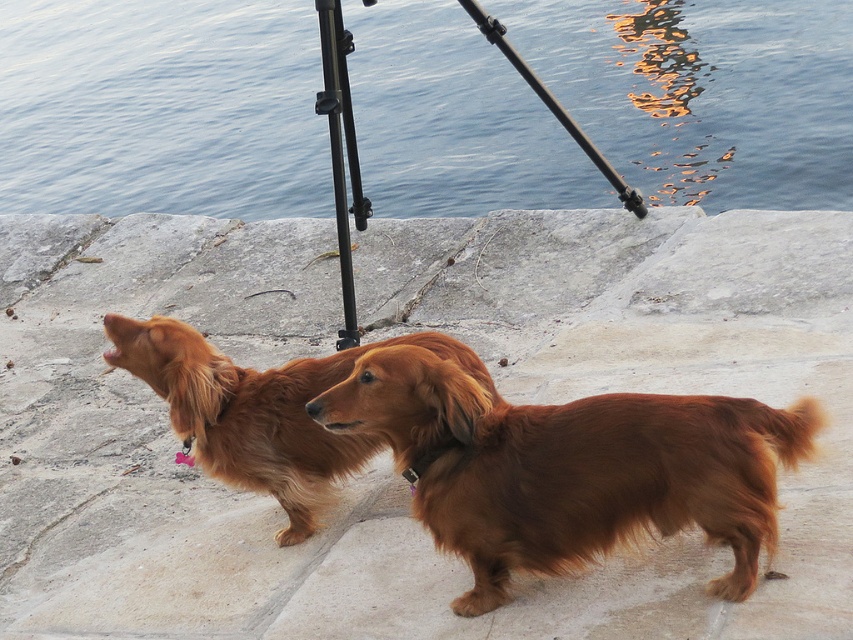
Question: Is brown furry dog at center above shiny brown fur at center?

Choices:
 (A) yes
 (B) no

Answer: (B)

Question: Does smooth concrete stone at center appear on the left side of shiny brown fur at center?

Choices:
 (A) no
 (B) yes

Answer: (A)

Question: Based on their relative distances, which object is farther from the blue water at upper center?

Choices:
 (A) black metal tripod at center
 (B) smooth concrete stone at center
 (C) shiny brown fur at center
 (D) brown furry dog at center

Answer: (D)

Question: Which object is the closest to the black metal tripod at center?

Choices:
 (A) blue water at upper center
 (B) shiny brown fur at center
 (C) brown furry dog at center

Answer: (B)

Question: Where is brown furry dog at center located in relation to black metal tripod at center in the image?

Choices:
 (A) above
 (B) below

Answer: (B)

Question: Estimate the real-world distances between objects in this image. Which object is farther from the shiny brown fur at center?

Choices:
 (A) smooth concrete stone at center
 (B) brown furry dog at center
 (C) black metal tripod at center
 (D) blue water at upper center

Answer: (D)